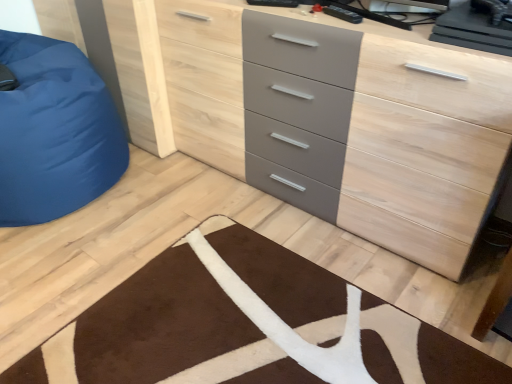
Question: Is brown plush rug at lower center spatially inside matte gray chest of drawers at center, or outside of it?

Choices:
 (A) inside
 (B) outside

Answer: (B)

Question: From the image's perspective, is brown plush rug at lower center above or below matte gray chest of drawers at center?

Choices:
 (A) above
 (B) below

Answer: (B)

Question: Estimate the real-world distances between objects in this image. Which object is closer to the brown plush rug at lower center?

Choices:
 (A) blue fabric bean bag at left
 (B) matte gray chest of drawers at center

Answer: (B)

Question: Estimate the real-world distances between objects in this image. Which object is closer to the blue fabric bean bag at left?

Choices:
 (A) matte gray chest of drawers at center
 (B) brown plush rug at lower center

Answer: (A)